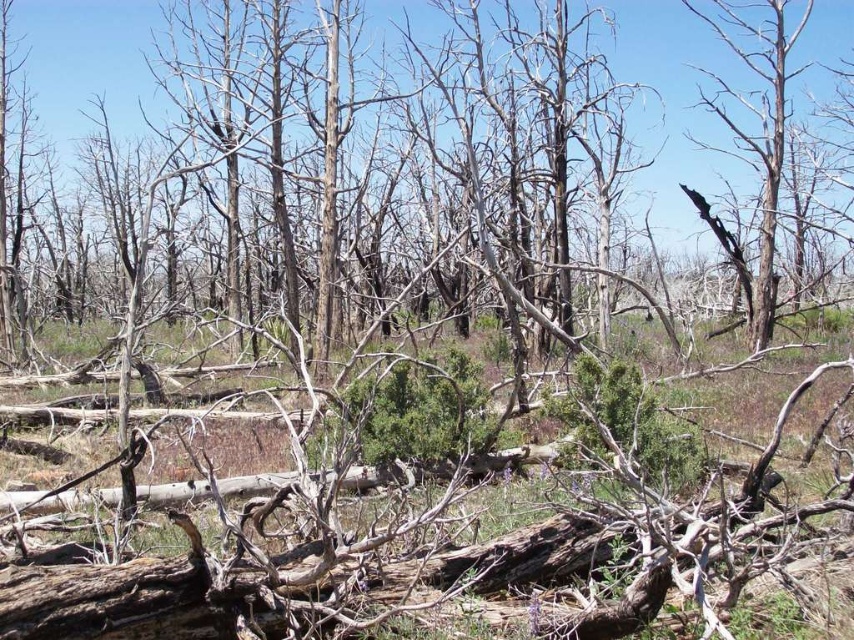
Can you confirm if dead wood at center is bigger than charred wood tree at right?

Yes.

Who is positioned more to the left, dead wood at center or charred wood tree at right?

dead wood at center is more to the left.

Locate an element on the screen. This screenshot has width=854, height=640. dead wood at center is located at coordinates (671, 109).